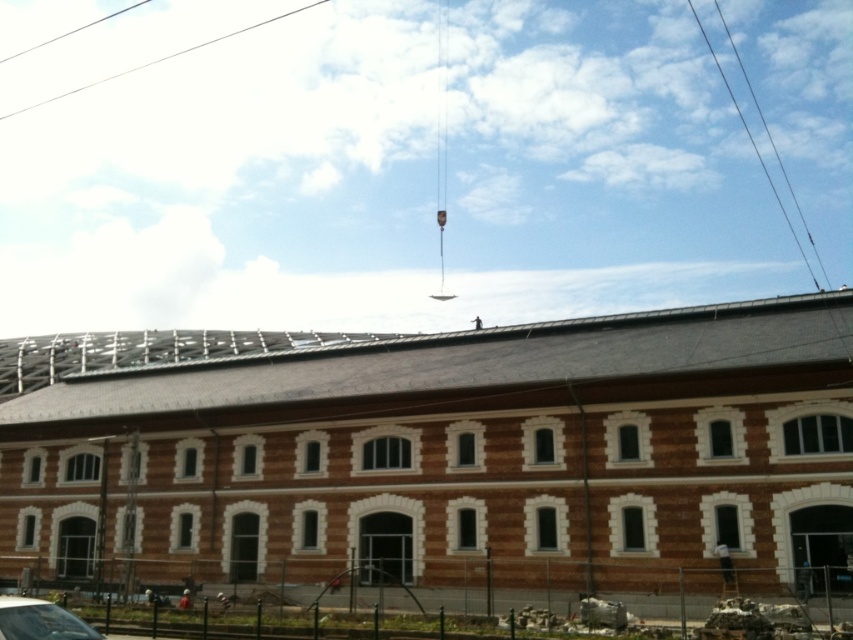
You are standing in front of the construction site and see two points marked on the crane. The first point is at coordinate point (x=44, y=611) and the second point is at coordinate point (x=283, y=16). Which point is closer to you?

Point (x=44, y=611) is closer to the viewer than point (x=283, y=16).

Consider the image. You are an inspector checking the construction site. You notice a clear glass car at lower left and a metallic wire at upper center. Which object is located to the right of the other?

The clear glass car at lower left is positioned on the right side of metallic wire at upper center.

Based on the photo, you are standing at the construction site and see the clear glass car at lower left. The safety regulations require that all vehicles must be at least 20 meters away from the crane operation zone. Are you compliant with the safety regulations?

The clear glass car at lower left is 18.29 meters away from the viewer, which is less than the required 20 meters. Therefore, you are not compliant with the safety regulations.